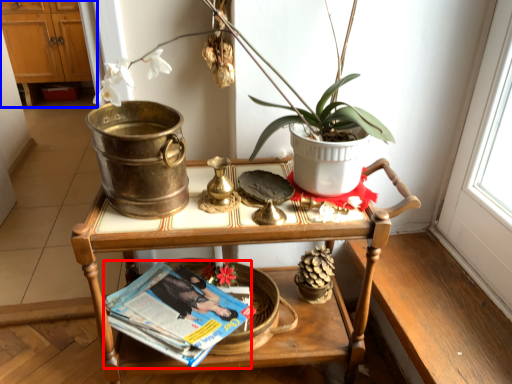
Question: Which object appears closest to the camera in this image, magazine (highlighted by a red box) or dresser (highlighted by a blue box)?

Choices:
 (A) magazine
 (B) dresser

Answer: (A)